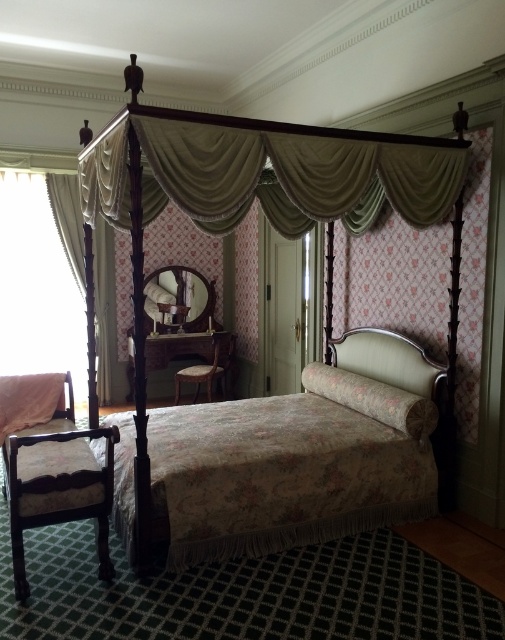
You are standing in the bedroom and want to move from the chair to the bed. Which point, point (433, 388) or point (70, 225), is closer to your starting position?

Point (70, 225) is closer to your starting position because it is behind point (433, 388), which is in front of it.

You are standing in the bedroom and want to move from the entrance to the floral fabric canopy bed at center. There is a white sheer curtain at left in your path. Can you walk directly to the bed without going around the curtain?

The floral fabric canopy bed at center is closer to the viewer than the white sheer curtain at left, so you can walk directly to the bed without needing to go around the curtain.